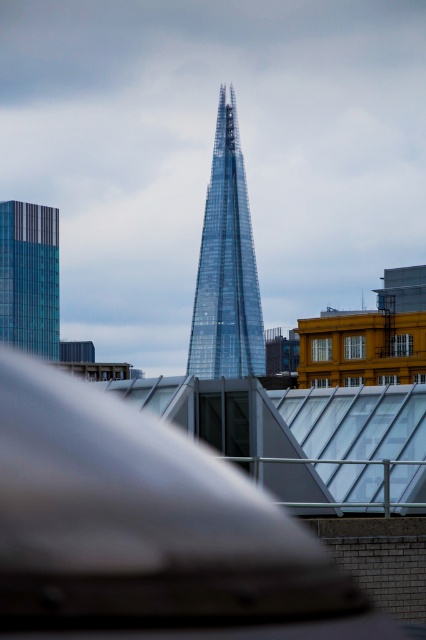
Is transparent glass tower at center below glassy teal skyscraper at left?

Actually, transparent glass tower at center is above glassy teal skyscraper at left.

In the scene shown: Which of these two, transparent glass tower at center or glassy teal skyscraper at left, stands taller?

transparent glass tower at center

Image resolution: width=426 pixels, height=640 pixels. I want to click on transparent glass tower at center, so click(227, 266).